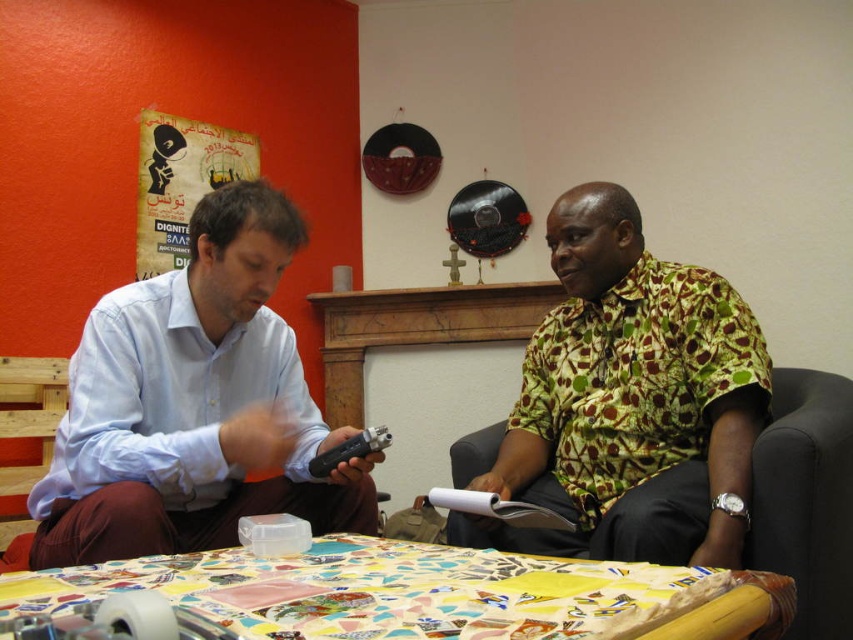
Question: Which object appears farthest from the camera in this image?

Choices:
 (A) green patterned shirt at center
 (B) green printed shirt at right

Answer: (B)

Question: Considering the relative positions of light blue shirt at left and green printed shirt at right in the image provided, where is light blue shirt at left located with respect to green printed shirt at right?

Choices:
 (A) left
 (B) right

Answer: (A)

Question: Which point appears closest to the camera in this image?

Choices:
 (A) (616, 202)
 (B) (798, 488)
 (C) (642, 593)

Answer: (C)

Question: Does green patterned shirt at center appear on the right side of green printed shirt at right?

Choices:
 (A) yes
 (B) no

Answer: (B)

Question: Which point is closer to the camera?

Choices:
 (A) (732, 611)
 (B) (453, 472)
 (C) (637, 324)
 (D) (206, 307)

Answer: (A)

Question: Is green printed shirt at right below multicolored mosaic table at center?

Choices:
 (A) yes
 (B) no

Answer: (B)